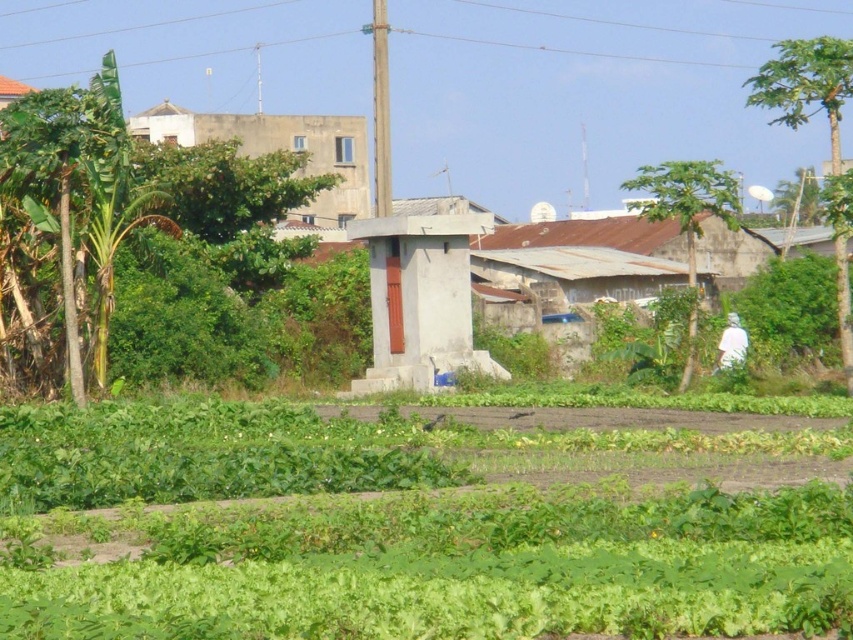
Is concrete building at upper center to the left of white matte shirt at right from the viewer's perspective?

Correct, you'll find concrete building at upper center to the left of white matte shirt at right.

Does concrete building at upper center appear over white matte shirt at right?

Yes.

What are the coordinates of `concrete building at upper center` in the screenshot? It's located at (281, 148).

Is green leafy at center shorter than concrete building at upper center?

Correct, green leafy at center is not as tall as concrete building at upper center.

Is green leafy at center wider than concrete building at upper center?

Correct, the width of green leafy at center exceeds that of concrete building at upper center.

Is point (833, 548) closer to viewer compared to point (338, 152)?

Yes, it is.

Where is `green leafy at center`? green leafy at center is located at coordinates [x=407, y=528].

Is the position of green leafy at center less distant than that of white matte shirt at right?

Yes, it is in front of white matte shirt at right.

Is green leafy at center further to the viewer compared to white matte shirt at right?

No, green leafy at center is closer to the viewer.

What do you see at coordinates (407, 528) in the screenshot? This screenshot has width=853, height=640. I see `green leafy at center` at bounding box center [407, 528].

Identify the location of green leafy at center. The image size is (853, 640). (407, 528).